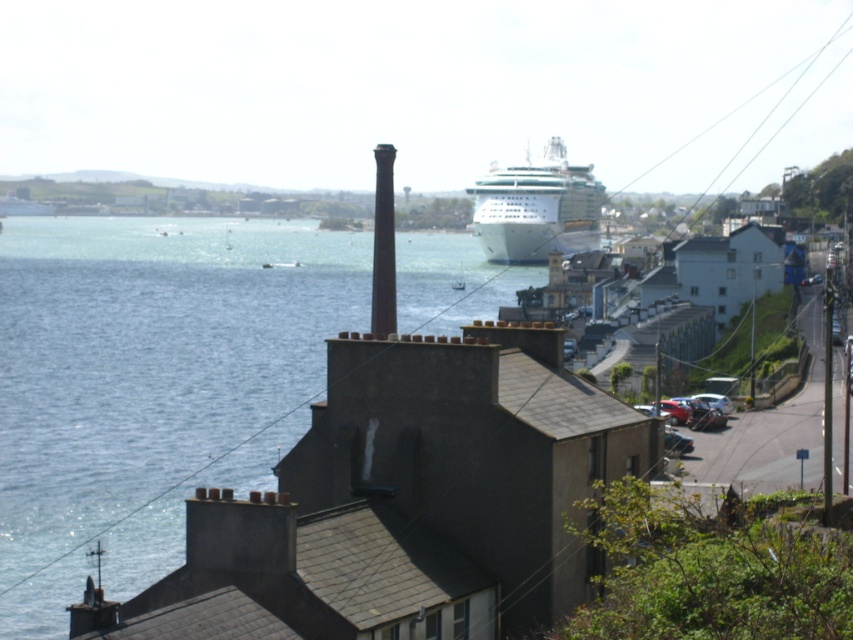
Who is lower down, blue water at center or white glossy cruise ship at center?

blue water at center

Can you confirm if blue water at center is bigger than white glossy cruise ship at center?

Indeed, blue water at center has a larger size compared to white glossy cruise ship at center.

Who is more forward, (126, 356) or (550, 252)?

Point (126, 356)

You are a GUI agent. You are given a task and a screenshot of the screen. Output one action in this format:
    pyautogui.click(x=<x>, y=<y>)
    Task: Click on the blue water at center
    The height and width of the screenshot is (640, 853).
    Given the screenshot: What is the action you would take?
    pyautogui.click(x=149, y=356)